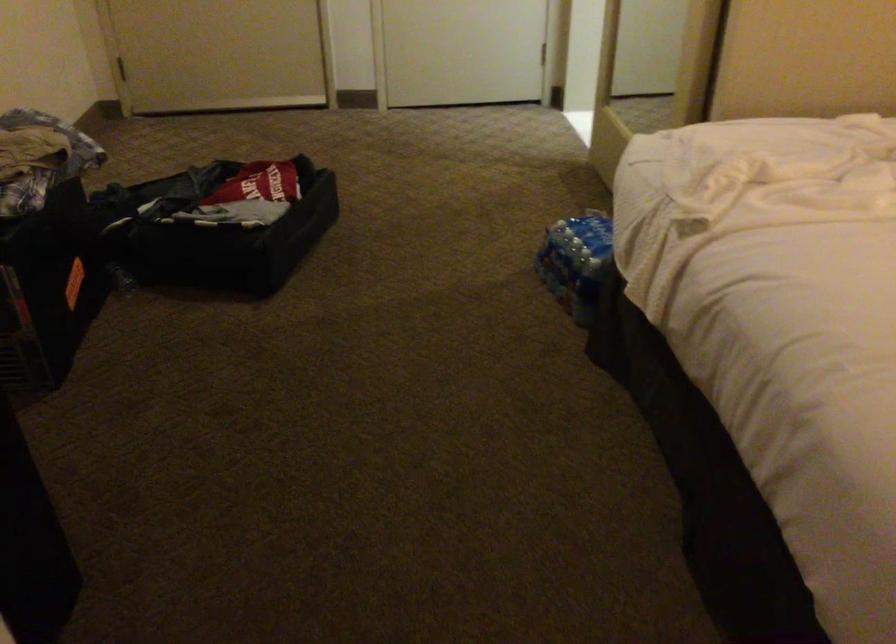
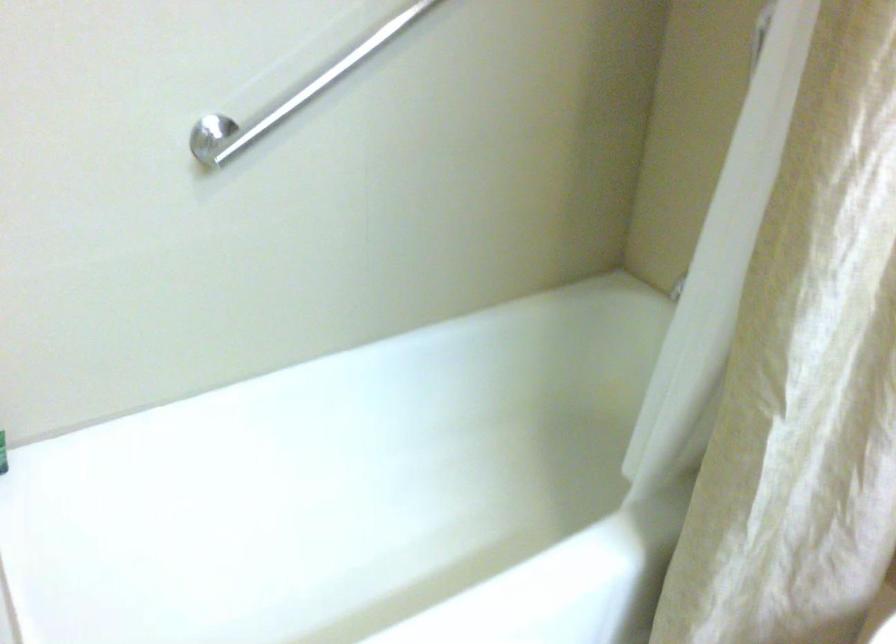
Question: Which direction would the cameraman need to move to produce the second image? Reply with the corresponding letter.

Choices:
 (A) Left
 (B) Right
 (C) Forward
 (D) Backward

Answer: (C)